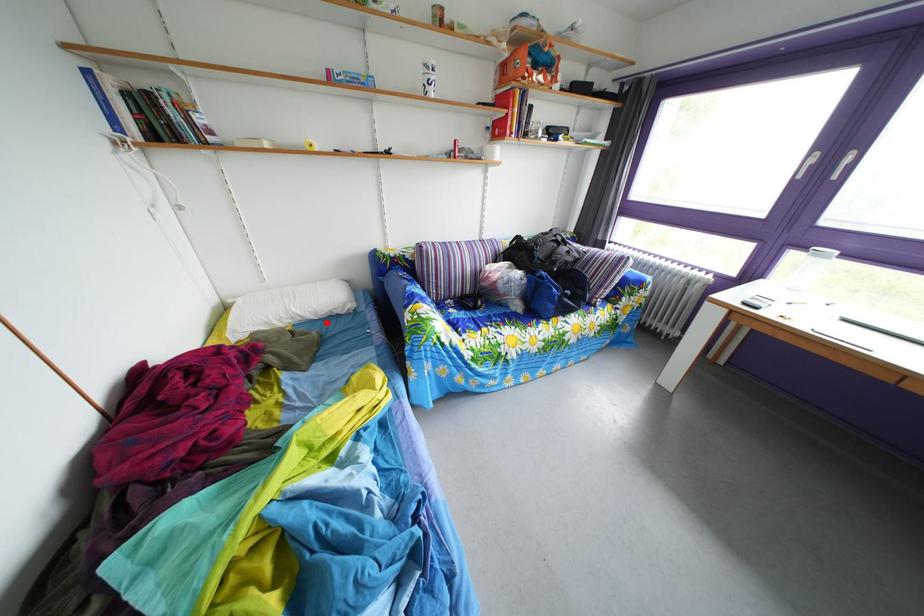
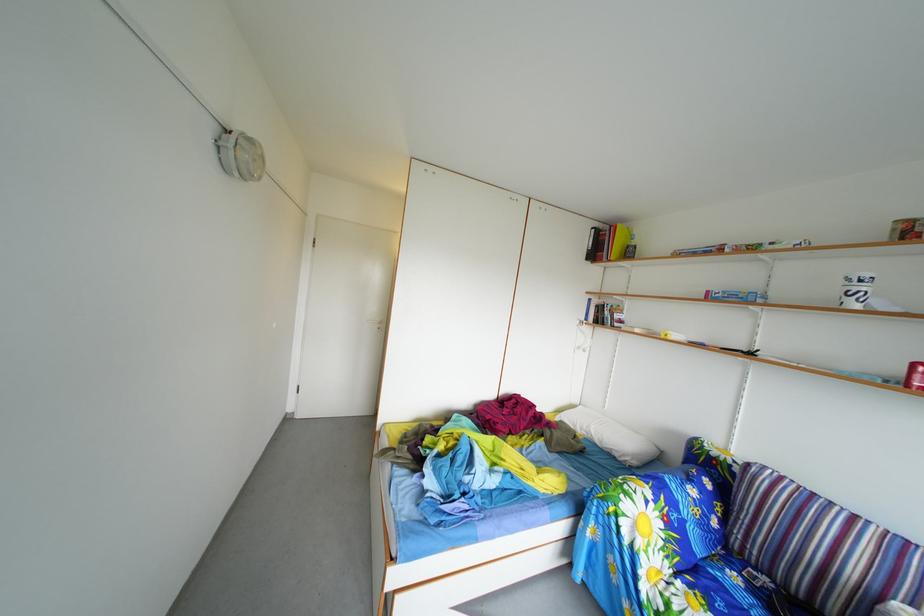
The point at the highlighted location is marked in the first image. Where is the corresponding point in the second image?

(612, 451)